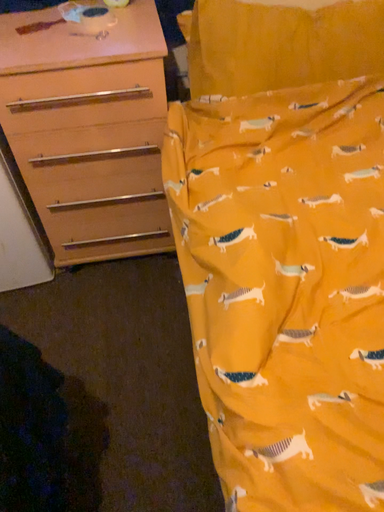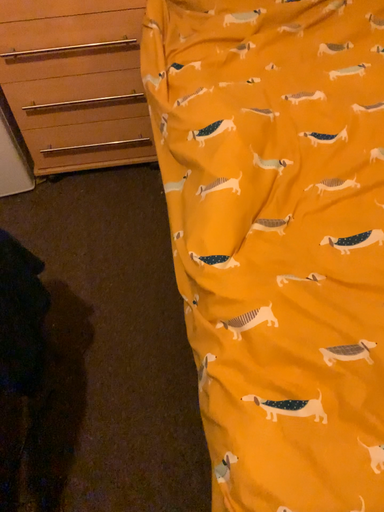
Question: How did the camera likely rotate when shooting the video?

Choices:
 (A) rotated downward
 (B) rotated upward

Answer: (A)